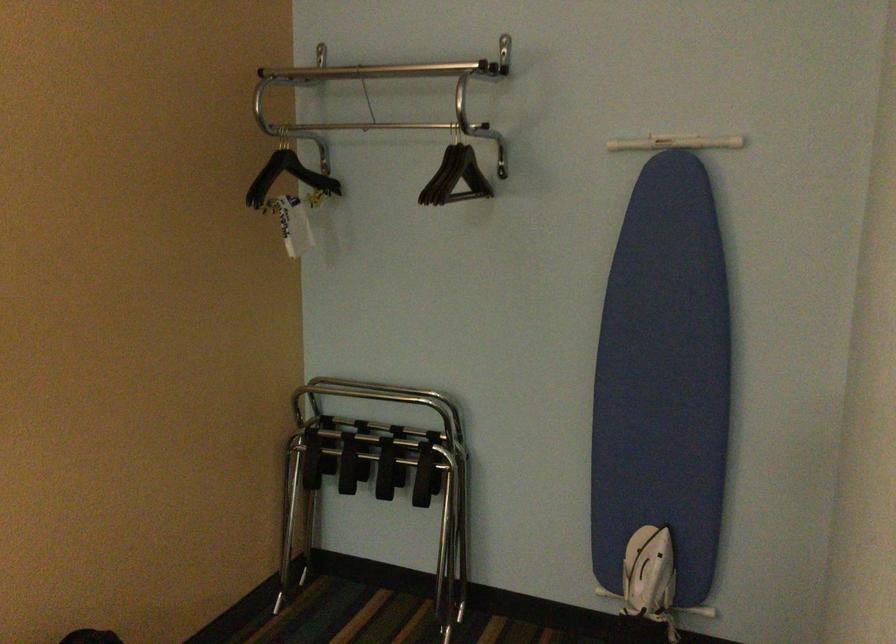
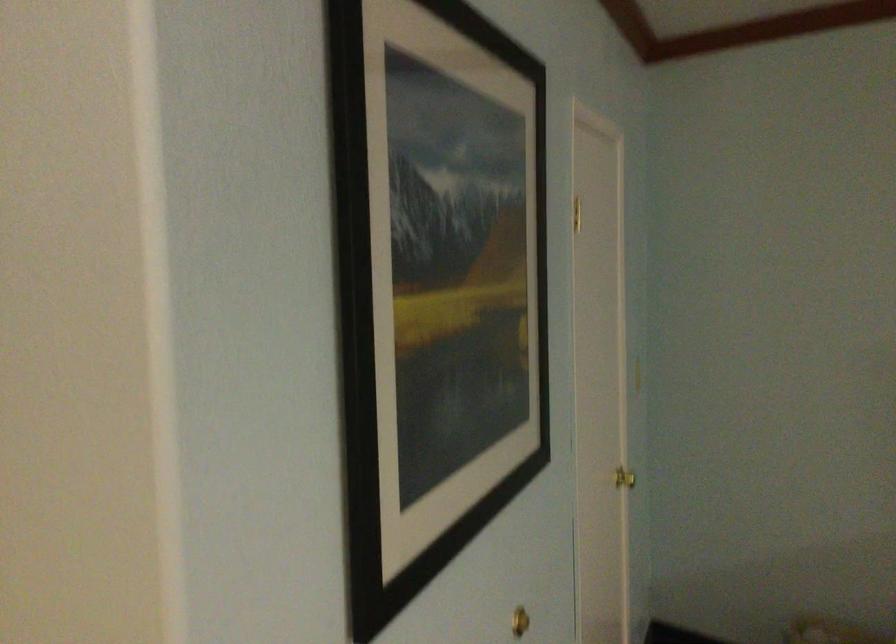
Question: The camera is either moving clockwise (left) or counter-clockwise (right) around the object. The first image is from the beginning of the video and the second image is from the end. Is the camera moving left or right when shooting the video?

Choices:
 (A) Left
 (B) Right

Answer: (A)